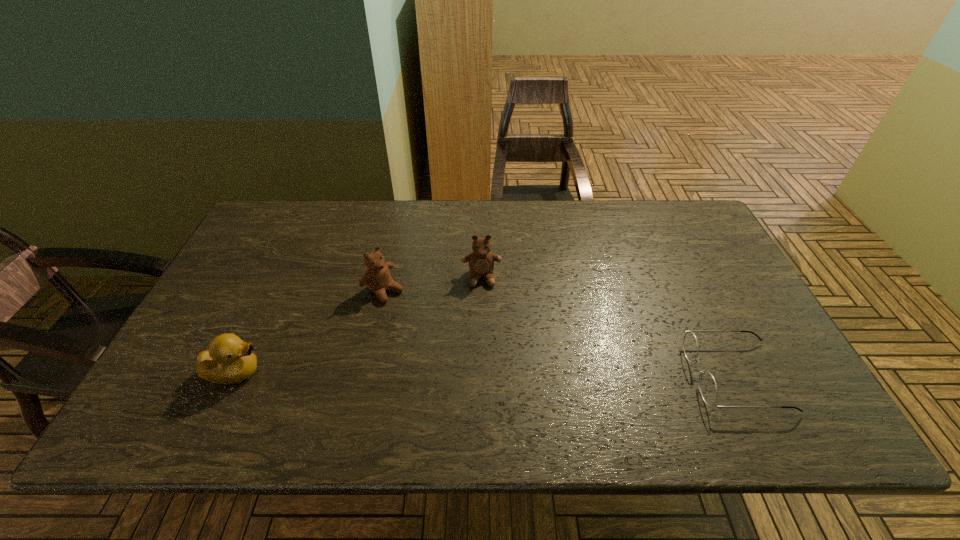
This screenshot has height=540, width=960. I want to click on the leftmost object, so click(x=229, y=360).

In order to click on the shortest object in this screenshot , I will do `click(707, 385)`.

Where is `the rightmost object`? the rightmost object is located at coordinates (x=707, y=385).

At what (x,y) coordinates should I click in order to perform the action: click on the third object from right to left. Please return your answer as a coordinate pair (x, y). Looking at the image, I should click on (377, 278).

Locate an element on the screen. The height and width of the screenshot is (540, 960). the third object from left to right is located at coordinates (481, 261).

You are a GUI agent. You are given a task and a screenshot of the screen. Output one action in this format:
    pyautogui.click(x=<x>, y=<y>)
    Task: Click on the vacant position located on the face of the leftmost object
    
    Given the screenshot: What is the action you would take?
    pyautogui.click(x=385, y=372)

This screenshot has width=960, height=540. I want to click on free space located on the front-facing side of the rightmost object, so click(622, 376).

I want to click on vacant point located 0.210m on the front-facing side of the rightmost object, so [600, 376].

You are a GUI agent. You are given a task and a screenshot of the screen. Output one action in this format:
    pyautogui.click(x=<x>, y=<y>)
    Task: Click on the vacant space located on the front-facing side of the rightmost object
    This screenshot has width=960, height=540.
    Given the screenshot: What is the action you would take?
    pyautogui.click(x=540, y=376)

Where is `free point located 0.360m on the face of the second object from left to right`? Image resolution: width=960 pixels, height=540 pixels. free point located 0.360m on the face of the second object from left to right is located at coordinates (496, 379).